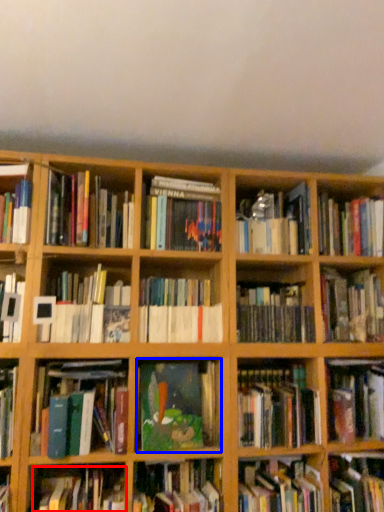
Question: Among these objects, which one is nearest to the camera, book (highlighted by a red box) or book (highlighted by a blue box)?

Choices:
 (A) book
 (B) book

Answer: (A)